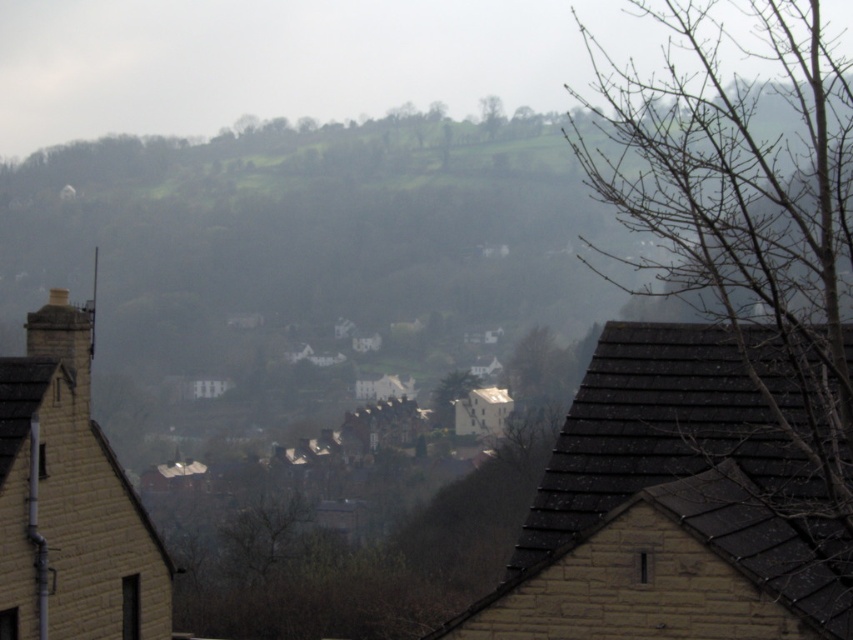
Is bare branches at upper right to the left of green leafy tree at upper center from the viewer's perspective?

No, bare branches at upper right is not to the left of green leafy tree at upper center.

Does bare branches at upper right have a lesser width compared to green leafy tree at upper center?

No, bare branches at upper right is not thinner than green leafy tree at upper center.

At what (x,y) coordinates should I click in order to perform the action: click on bare branches at upper right. Please return your answer as a coordinate pair (x, y). This screenshot has width=853, height=640. Looking at the image, I should click on (753, 248).